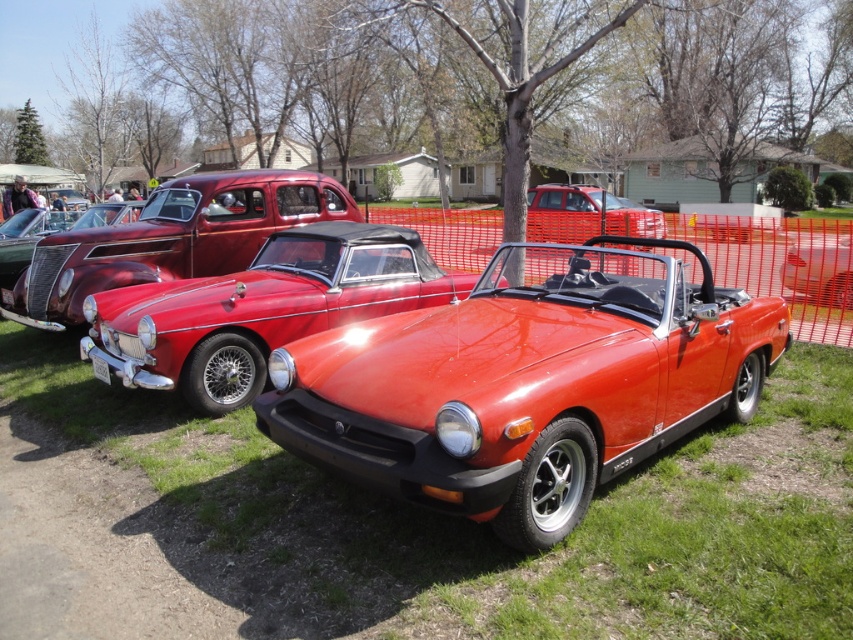
You are standing at the origin point in the image. The shiny red convertible at center is located at coordinates 0.598, 0.618. If you want to move towards it, in which direction should you head?

The shiny red convertible at center is located at coordinates (526, 381), so you should move towards the center of the image to reach it.

You are a photographer trying to capture both the glossy red convertible at center and the metallic red convertible at center in a single shot. Which car should you position closer to the camera to ensure both are fully visible in the frame?

Since the glossy red convertible at center is not as tall as the metallic red convertible at center, you should position the glossy red convertible at center closer to the camera to ensure both are fully visible in the frame.